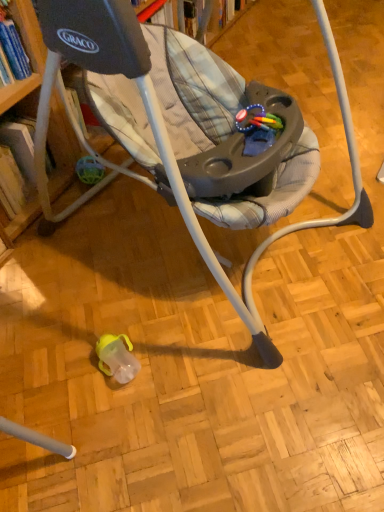
In order to face hardcover book at left, should I rotate leftwards or rightwards?

Rotate your view left by about 23.896°.

This screenshot has height=512, width=384. Describe the element at coordinates (182, 134) in the screenshot. I see `matte gray baby swing at center` at that location.

Locate an element on the screen. hardcover book at left is located at coordinates (20, 144).

From a real-world perspective, between rubberized plastic teething ring at center and hardcover book at left, who is vertically lower?

In real-world perspective, hardcover book at left is lower.

From the image's perspective, would you say rubberized plastic teething ring at center is positioned over hardcover book at left?

Yes, from the image's perspective, rubberized plastic teething ring at center is above hardcover book at left.

Considering the relative positions of rubberized plastic teething ring at center and hardcover book at left in the image provided, is rubberized plastic teething ring at center behind hardcover book at left?

No, it is in front of hardcover book at left.

Is rubberized plastic teething ring at center far from hardcover book at left?

rubberized plastic teething ring at center is near hardcover book at left, not far away.

This screenshot has width=384, height=512. Identify the location of toy that is under the matte gray baby swing at center (from a real-world perspective). (258, 128).

Could matte gray baby swing at center be considered to be inside rubberized plastic teething ring at center?

No, matte gray baby swing at center is not a part of rubberized plastic teething ring at center.

Which of these two, rubberized plastic teething ring at center or matte gray baby swing at center, stands taller?

matte gray baby swing at center.

Is there a large distance between rubberized plastic teething ring at center and matte gray baby swing at center?

They are positioned close to each other.

You are a GUI agent. You are given a task and a screenshot of the screen. Output one action in this format:
    pyautogui.click(x=<x>, y=<y>)
    Task: Click on the chair above the hardcover book at left (from the image's perspective)
    The width and height of the screenshot is (384, 512).
    Given the screenshot: What is the action you would take?
    pyautogui.click(x=182, y=134)

From the image's perspective, which is above, matte gray baby swing at center or hardcover book at left?

matte gray baby swing at center.

From a real-world perspective, who is located lower, matte gray baby swing at center or hardcover book at left?

In real-world perspective, hardcover book at left is lower.

Would you consider matte gray baby swing at center to be distant from hardcover book at left?

That's not correct — matte gray baby swing at center is a little close to hardcover book at left.

From the image's perspective, is matte gray baby swing at center positioned above or below rubberized plastic teething ring at center?

Based on their image positions, matte gray baby swing at center is located above rubberized plastic teething ring at center.

Does matte gray baby swing at center have a larger size compared to rubberized plastic teething ring at center?

Indeed, matte gray baby swing at center has a larger size compared to rubberized plastic teething ring at center.

Can you confirm if matte gray baby swing at center is shorter than rubberized plastic teething ring at center?

In fact, matte gray baby swing at center may be taller than rubberized plastic teething ring at center.

How distant is matte gray baby swing at center from rubberized plastic teething ring at center?

matte gray baby swing at center is 10.49 inches from rubberized plastic teething ring at center.

Does hardcover book at left contain matte gray baby swing at center?

No, hardcover book at left does not contain matte gray baby swing at center.

Locate an element on the screen. The width and height of the screenshot is (384, 512). book lying behind the matte gray baby swing at center is located at coordinates (20, 144).

Considering the sizes of objects hardcover book at left and matte gray baby swing at center in the image provided, who is wider, hardcover book at left or matte gray baby swing at center?

With larger width is matte gray baby swing at center.

Who is bigger, hardcover book at left or rubberized plastic teething ring at center?

Bigger between the two is hardcover book at left.

In the scene shown: Are hardcover book at left and rubberized plastic teething ring at center beside each other?

hardcover book at left and rubberized plastic teething ring at center are not in contact.

Locate an element on the screen. Image resolution: width=384 pixels, height=512 pixels. book behind the rubberized plastic teething ring at center is located at coordinates (20, 144).

Is point (27, 138) positioned in front of point (277, 118)?

No, it is not.

Locate an element on the screen. The width and height of the screenshot is (384, 512). toy that appears above the hardcover book at left (from the image's perspective) is located at coordinates (258, 128).

Identify the location of toy below the matte gray baby swing at center (from the image's perspective). The height and width of the screenshot is (512, 384). (258, 128).

Looking at the image, which one is located further to rubberized plastic teething ring at center, hardcover book at left or matte gray baby swing at center?

The object further to rubberized plastic teething ring at center is hardcover book at left.

Which object lies further to the anchor point matte gray baby swing at center, hardcover book at left or rubberized plastic teething ring at center?

hardcover book at left lies further to matte gray baby swing at center than the other object.

Based on the photo, estimate the real-world distances between objects in this image. Which object is closer to hardcover book at left, matte gray baby swing at center or rubberized plastic teething ring at center?

matte gray baby swing at center is positioned closer to the anchor hardcover book at left.

Estimate the real-world distances between objects in this image. Which object is further from hardcover book at left, rubberized plastic teething ring at center or matte gray baby swing at center?

The object further to hardcover book at left is rubberized plastic teething ring at center.

Based on their spatial positions, is matte gray baby swing at center or hardcover book at left further from rubberized plastic teething ring at center?

Based on the image, hardcover book at left appears to be further to rubberized plastic teething ring at center.

When comparing their distances from matte gray baby swing at center, does rubberized plastic teething ring at center or hardcover book at left seem further?

hardcover book at left is positioned further to the anchor matte gray baby swing at center.

The image size is (384, 512). I want to click on toy positioned between matte gray baby swing at center and hardcover book at left from near to far, so click(258, 128).